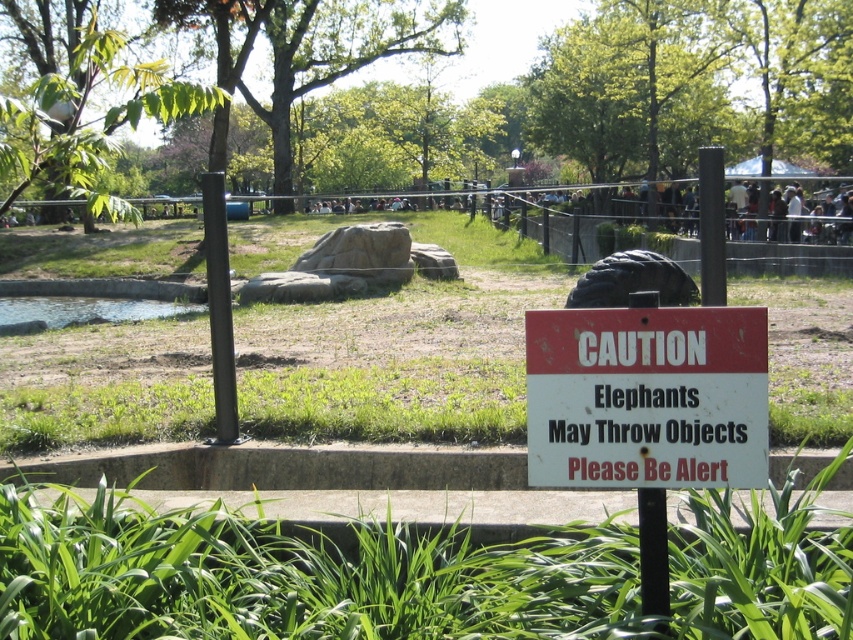
Question: Estimate the real-world distances between objects in this image. Which object is farther from the green leafy grass at lower center?

Choices:
 (A) white paper sign at center
 (B) black metal fence at upper center

Answer: (B)

Question: Does green leafy grass at lower center have a lesser width compared to white paper sign at center?

Choices:
 (A) yes
 (B) no

Answer: (B)

Question: From the image, what is the correct spatial relationship of white paper sign at center in relation to black metal fence at upper center?

Choices:
 (A) below
 (B) above

Answer: (A)

Question: Estimate the real-world distances between objects in this image. Which object is farther from the green leafy grass at lower center?

Choices:
 (A) black metal fence at upper center
 (B) white paper sign at center

Answer: (A)

Question: Which point appears closest to the camera in this image?

Choices:
 (A) (346, 556)
 (B) (84, 244)
 (C) (608, 410)

Answer: (C)

Question: Can you confirm if white paper sign at center is wider than black metal fence at upper center?

Choices:
 (A) yes
 (B) no

Answer: (B)